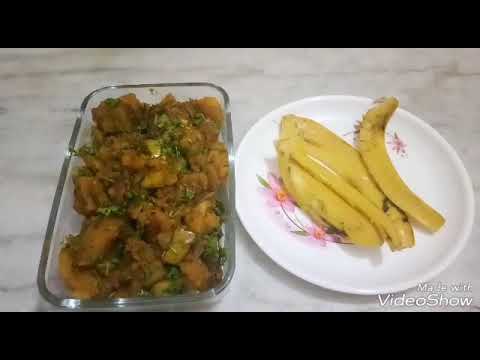
Identify the location of plate. (306, 249).